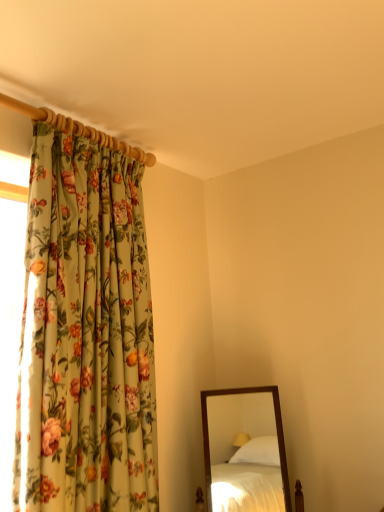
The image size is (384, 512). I want to click on wooden-framed mirror at lower right, so click(245, 451).

What do you see at coordinates (245, 451) in the screenshot? I see `wooden-framed mirror at lower right` at bounding box center [245, 451].

What do you see at coordinates (85, 335) in the screenshot?
I see `floral fabric curtain at left` at bounding box center [85, 335].

The height and width of the screenshot is (512, 384). Identify the location of floral fabric curtain at left. (85, 335).

This screenshot has height=512, width=384. What are the coordinates of `wooden-framed mirror at lower right` in the screenshot? It's located at (245, 451).

Between wooden-framed mirror at lower right and floral fabric curtain at left, which one appears on the left side from the viewer's perspective?

floral fabric curtain at left.

Which object is more forward, wooden-framed mirror at lower right or floral fabric curtain at left?

Positioned in front is floral fabric curtain at left.

Considering the positions of point (238, 466) and point (82, 456), is point (238, 466) closer or farther from the camera than point (82, 456)?

Point (238, 466).

From the image's perspective, relative to floral fabric curtain at left, is wooden-framed mirror at lower right above or below?

Clearly, from the image's perspective, wooden-framed mirror at lower right is below floral fabric curtain at left.

From a real-world perspective, is wooden-framed mirror at lower right above or below floral fabric curtain at left?

Clearly, from a real-world perspective, wooden-framed mirror at lower right is below floral fabric curtain at left.

Considering the sizes of wooden-framed mirror at lower right and floral fabric curtain at left in the image, is wooden-framed mirror at lower right wider or thinner than floral fabric curtain at left?

wooden-framed mirror at lower right is wider than floral fabric curtain at left.

Who is taller, wooden-framed mirror at lower right or floral fabric curtain at left?

With more height is floral fabric curtain at left.

Based on the photo, considering the sizes of objects wooden-framed mirror at lower right and floral fabric curtain at left in the image provided, who is smaller, wooden-framed mirror at lower right or floral fabric curtain at left?

Smaller between the two is wooden-framed mirror at lower right.

Can we say wooden-framed mirror at lower right lies outside floral fabric curtain at left?

Yes.

Would you consider wooden-framed mirror at lower right to be distant from floral fabric curtain at left?

Absolutely, wooden-framed mirror at lower right is distant from floral fabric curtain at left.

In the scene shown: Is wooden-framed mirror at lower right oriented away from floral fabric curtain at left?

wooden-framed mirror at lower right is not turned away from floral fabric curtain at left.

The image size is (384, 512). There is a wooden-framed mirror at lower right. Find the location of `curtain above it (from a real-world perspective)`. curtain above it (from a real-world perspective) is located at coordinates (85, 335).

In the scene shown: Which is more to the right, floral fabric curtain at left or wooden-framed mirror at lower right?

Positioned to the right is wooden-framed mirror at lower right.

Between floral fabric curtain at left and wooden-framed mirror at lower right, which one is positioned in front?

floral fabric curtain at left.

Considering the positions of points (94, 157) and (263, 490), is point (94, 157) farther from camera compared to point (263, 490)?

That is False.

From the image's perspective, is floral fabric curtain at left on top of wooden-framed mirror at lower right?

Yes, from the image's perspective, floral fabric curtain at left is above wooden-framed mirror at lower right.

From a real-world perspective, relative to wooden-framed mirror at lower right, is floral fabric curtain at left vertically above or below?

Clearly, from a real-world perspective, floral fabric curtain at left is above wooden-framed mirror at lower right.

Does floral fabric curtain at left have a lesser width compared to wooden-framed mirror at lower right?

Correct, the width of floral fabric curtain at left is less than that of wooden-framed mirror at lower right.

Does floral fabric curtain at left have a greater height compared to wooden-framed mirror at lower right?

Indeed, floral fabric curtain at left has a greater height compared to wooden-framed mirror at lower right.

Looking at this image, is floral fabric curtain at left bigger or smaller than wooden-framed mirror at lower right?

Considering their sizes, floral fabric curtain at left takes up more space than wooden-framed mirror at lower right.

Does floral fabric curtain at left contain wooden-framed mirror at lower right?

Definitely not — wooden-framed mirror at lower right is not inside floral fabric curtain at left.

Can you see floral fabric curtain at left touching wooden-framed mirror at lower right?

floral fabric curtain at left and wooden-framed mirror at lower right are not in contact.

Is floral fabric curtain at left oriented towards wooden-framed mirror at lower right?

No, floral fabric curtain at left is not turned towards wooden-framed mirror at lower right.

How many degrees apart are the facing directions of floral fabric curtain at left and wooden-framed mirror at lower right?

There is a 55.3-degree angle between the facing directions of floral fabric curtain at left and wooden-framed mirror at lower right.

Identify the location of curtain lying above the wooden-framed mirror at lower right (from the image's perspective). The image size is (384, 512). (85, 335).

Locate an element on the screen. Image resolution: width=384 pixels, height=512 pixels. curtain in front of the wooden-framed mirror at lower right is located at coordinates (85, 335).

You are a GUI agent. You are given a task and a screenshot of the screen. Output one action in this format:
    pyautogui.click(x=<x>, y=<y>)
    Task: Click on the curtain above the wooden-framed mirror at lower right (from a real-world perspective)
    
    Given the screenshot: What is the action you would take?
    pyautogui.click(x=85, y=335)